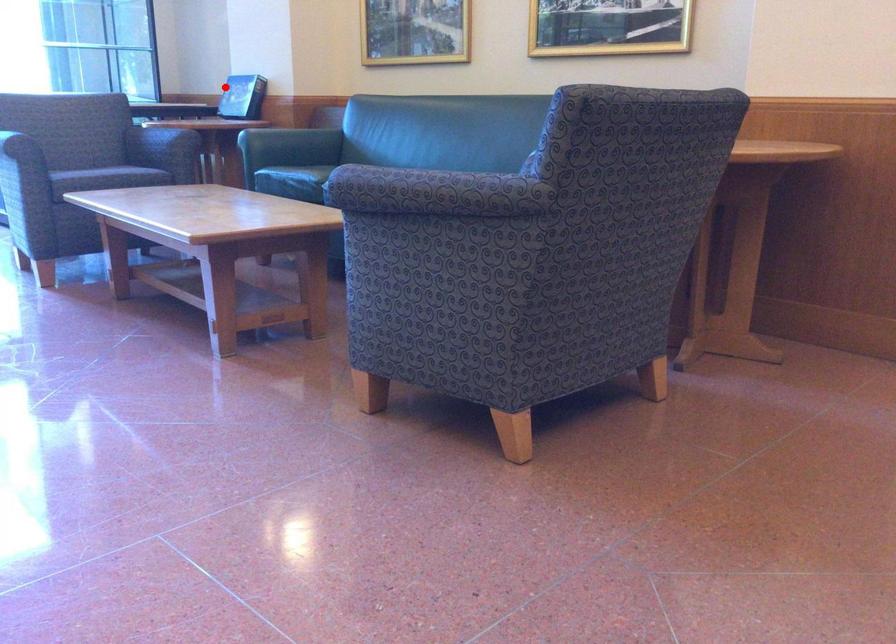
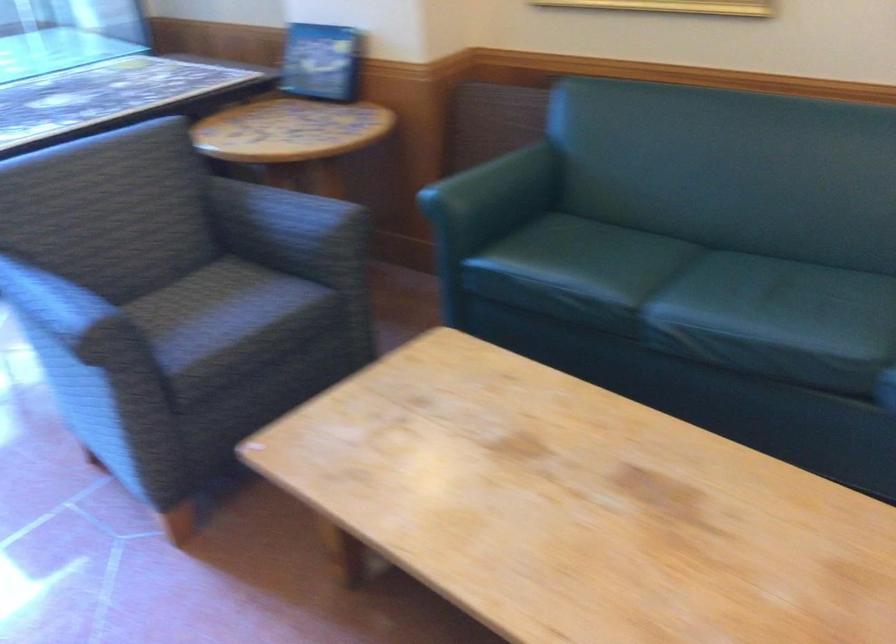
Question: I am providing you with two images of the same scene from different viewpoints. A red point is shown in image1. For the corresponding object point in image2, is it positioned nearer or farther from the camera?

Choices:
 (A) Nearer
 (B) Farther

Answer: (A)